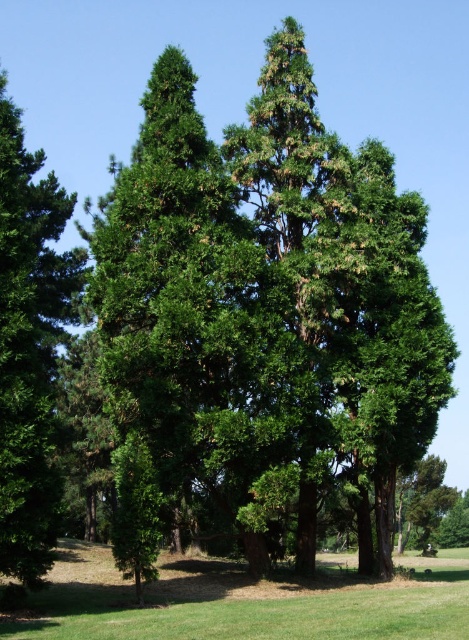
Who is positioned more to the right, green leafy tree at center or green grassy field at lower center?

From the viewer's perspective, green grassy field at lower center appears more on the right side.

Is green leafy tree at center taller than green grassy field at lower center?

Yes.

Is point (193, 336) less distant than point (349, 561)?

Yes, it is.

The height and width of the screenshot is (640, 469). I want to click on green leafy tree at center, so click(x=269, y=305).

Who is shorter, green leafy tree at center or green leafy tree at left?

green leafy tree at left is shorter.

Is green leafy tree at center behind green leafy tree at left?

Yes, it is behind green leafy tree at left.

What do you see at coordinates (269, 305) in the screenshot? I see `green leafy tree at center` at bounding box center [269, 305].

You are a GUI agent. You are given a task and a screenshot of the screen. Output one action in this format:
    pyautogui.click(x=<x>, y=<y>)
    Task: Click on the green leafy tree at center
    The width and height of the screenshot is (469, 640).
    Given the screenshot: What is the action you would take?
    pyautogui.click(x=269, y=305)

Who is more distant from viewer, (80, 564) or (47, 412)?

Positioned behind is point (80, 564).

Can you confirm if green grassy field at lower center is wider than green leafy tree at left?

Correct, the width of green grassy field at lower center exceeds that of green leafy tree at left.

Which is behind, point (204, 628) or point (0, 422)?

Point (0, 422)

Identify the location of green grassy field at lower center. Image resolution: width=469 pixels, height=640 pixels. (242, 600).